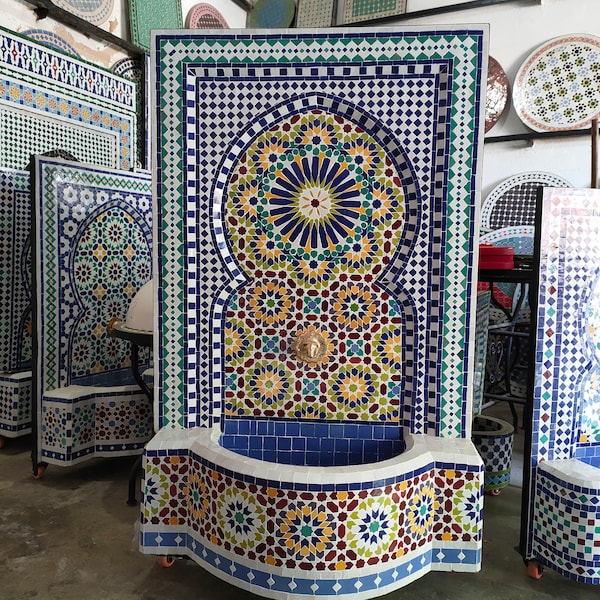
The height and width of the screenshot is (600, 600). I want to click on row of blue tiles, so click(x=297, y=446), click(x=308, y=425), click(x=307, y=458).